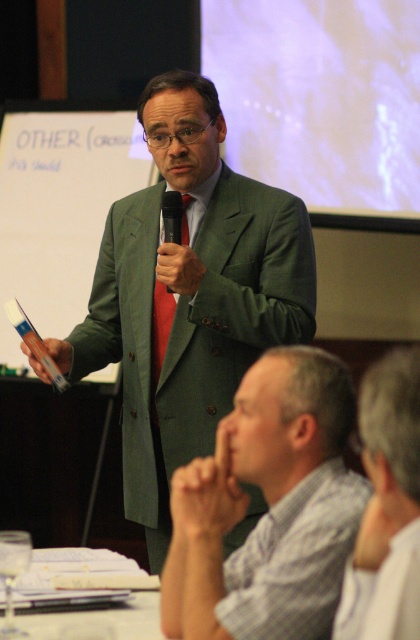
Is green wool suit at center bigger than red satin tie at center?

Yes.

Between green wool suit at center and red satin tie at center, which one appears on the left side from the viewer's perspective?

From the viewer's perspective, red satin tie at center appears more on the left side.

This screenshot has height=640, width=420. Identify the location of green wool suit at center. (189, 296).

Consider the image. Measure the distance between green wool suit at center and camera.

green wool suit at center and camera are 2.44 meters apart from each other.

Based on the photo, is green wool suit at center bigger than black matte microphone at center?

Correct, green wool suit at center is larger in size than black matte microphone at center.

Where is `green wool suit at center`? green wool suit at center is located at coordinates (189, 296).

Which is below, gray fabric shirt at lower right or red satin tie at center?

gray fabric shirt at lower right

Can you confirm if gray fabric shirt at lower right is positioned below red satin tie at center?

Indeed, gray fabric shirt at lower right is positioned under red satin tie at center.

The image size is (420, 640). Identify the location of gray fabric shirt at lower right. 386,508.